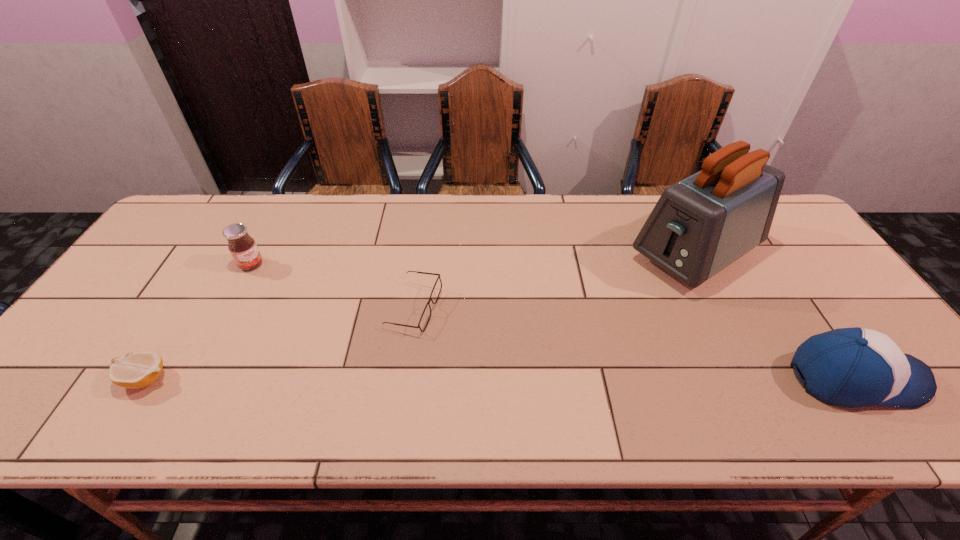
In order to click on vacant space in between the baseball cap and the second object from left to right in this screenshot , I will do `click(553, 321)`.

You are a GUI agent. You are given a task and a screenshot of the screen. Output one action in this format:
    pyautogui.click(x=<x>, y=<y>)
    Task: Click on the vacant area that lies between the toaster and the leftmost object
    The height and width of the screenshot is (540, 960).
    Given the screenshot: What is the action you would take?
    pyautogui.click(x=420, y=317)

You are a GUI agent. You are given a task and a screenshot of the screen. Output one action in this format:
    pyautogui.click(x=<x>, y=<y>)
    Task: Click on the empty space that is in between the fourth object from right to left and the spectacles
    This screenshot has width=960, height=540.
    Given the screenshot: What is the action you would take?
    pyautogui.click(x=333, y=286)

Find the location of `free spot between the baseball cap and the lemon`. free spot between the baseball cap and the lemon is located at coordinates (500, 379).

The image size is (960, 540). Find the location of `unoccupied position between the fourth object from right to left and the toaster`. unoccupied position between the fourth object from right to left and the toaster is located at coordinates (473, 260).

Identify the location of vacant area that lies between the spectacles and the baseball cap. Image resolution: width=960 pixels, height=540 pixels. 634,343.

What are the coordinates of `free space that is in between the baseball cap and the third object from left to right` in the screenshot? It's located at (634, 343).

In order to click on blank region between the tallest object and the third object from right to left in this screenshot , I will do `click(554, 281)`.

Locate an element on the screen. This screenshot has width=960, height=540. vacant space that is in between the lemon and the jam is located at coordinates (199, 322).

Select which object is the third closest to the third object from left to right. Please provide its 2D coordinates. Your answer should be formatted as a tuple, i.e. [(x, y)], where the tuple contains the x and y coordinates of a point satisfying the conditions above.

[(700, 225)]